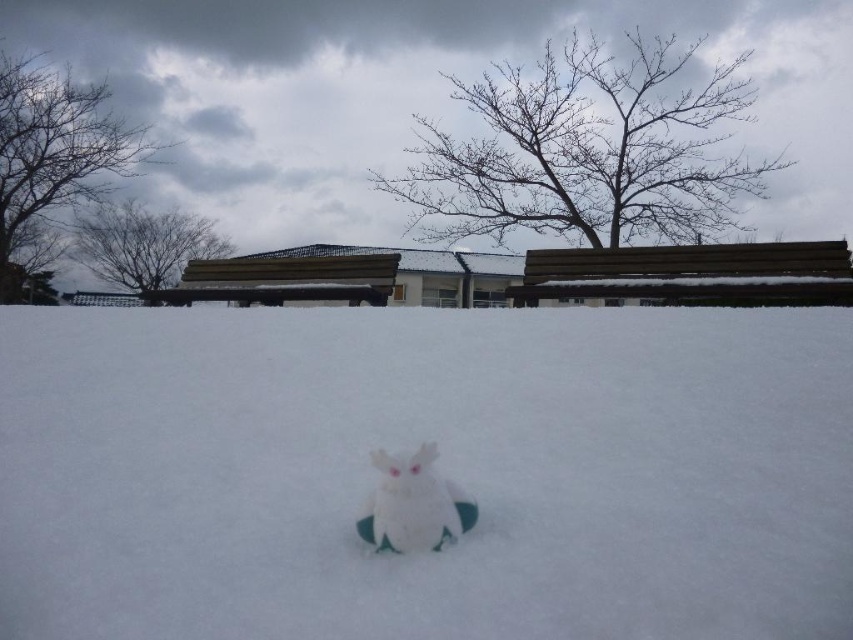
You are standing in the snowy scene and want to place a small gift box between the white fluffy snow at center and the wooden bench at upper right. Based on their positions, which object should the gift box be closer to?

The white fluffy snow at center is to the left of the wooden bench at upper right, so the gift box should be placed closer to the wooden bench at upper right to maintain the left to right order.

You are standing at the edge of the snowy area and want to place a small gift box between the white fluffy snow at center and the wooden bench at upper right. The gift box requires a space of 2 meters. Is there enough space between them for the gift box?

The distance between the white fluffy snow at center and the wooden bench at upper right is 4.39 meters, which is more than enough to accommodate the 2 meter space required for the gift box.